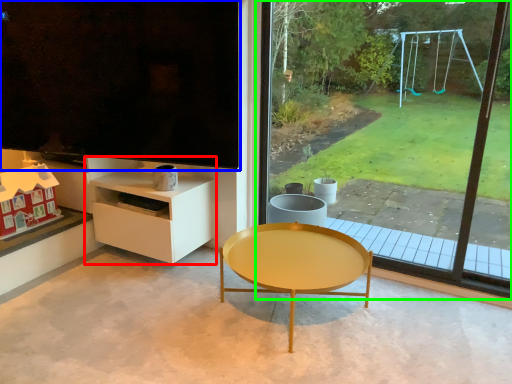
Question: Based on their relative distances, which object is nearer to shelf (highlighted by a red box)? Choose from window screen (highlighted by a blue box) and window (highlighted by a green box).

Choices:
 (A) window screen
 (B) window

Answer: (A)